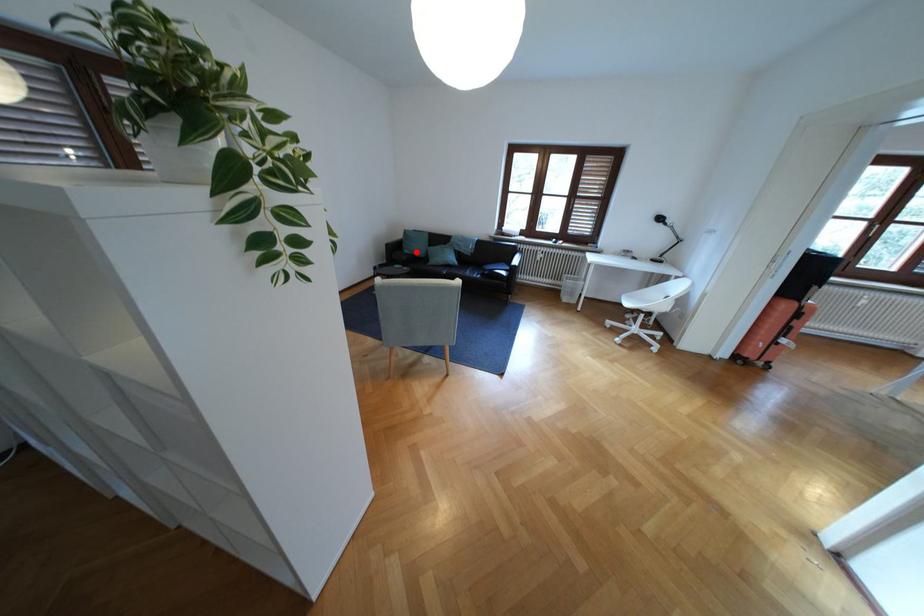
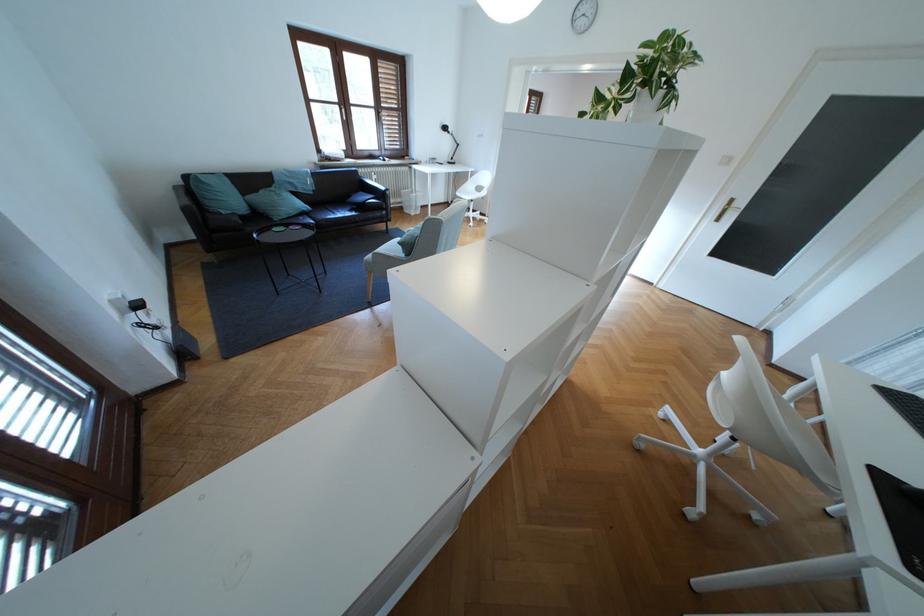
Where in the second image is the point corresponding to the highlighted location from the first image?

(234, 213)